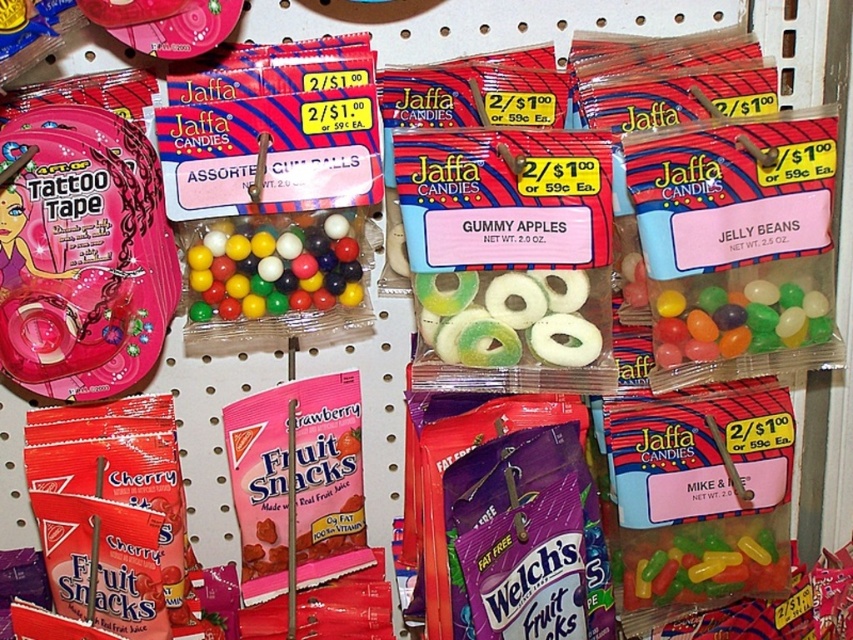
You are a customer at the store and want to grab both the glossy plastic gumballs at center and the translucent jelly beans at center. Which one should you reach for first if you want to pick up the lower item first?

The translucent jelly beans at center are lower than the glossy plastic gumballs at center, so you should reach for the translucent jelly beans at center first.

You are a customer looking to buy candies. You see the glossy plastic gumballs at center and the translucent jelly beans at center. Which one takes up more space on the shelf?

The glossy plastic gumballs at center takes up more space on the shelf because it is larger in size than the translucent jelly beans at center.

You are a customer looking to buy both the glossy plastic gumballs at center and the translucent jelly beans at right. If you want to pick up the gumballs first, which one should you reach for first?

The glossy plastic gumballs at center is positioned over the translucent jelly beans at right, so you should reach for the glossy plastic gumballs at center first.